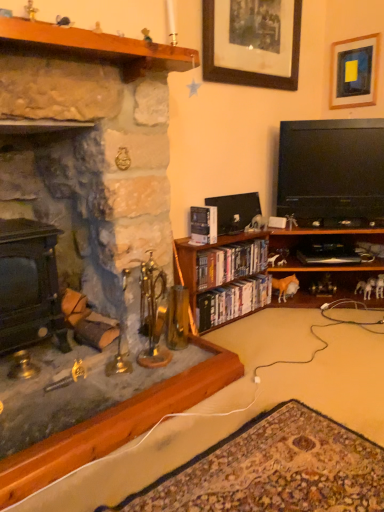
Question: Which direction should I rotate to face hardcover book at center, which is the 1th book in top-to-bottom order, — up or down?

Choices:
 (A) down
 (B) up

Answer: (B)

Question: Is matte black fireplace at left, which appears as the first fireplace when viewed from the right, at the left side of matte black stove at left, arranged as the 2th fireplace when viewed from the right?

Choices:
 (A) no
 (B) yes

Answer: (A)

Question: Can you confirm if matte black fireplace at left, which appears as the first fireplace when viewed from the right, is bigger than matte black stove at left, the first fireplace in the left-to-right sequence?

Choices:
 (A) yes
 (B) no

Answer: (A)

Question: From the image's perspective, does matte black fireplace at left, placed as the second fireplace when sorted from left to right, appear higher than matte black stove at left, arranged as the 2th fireplace when viewed from the right?

Choices:
 (A) no
 (B) yes

Answer: (B)

Question: Does matte black fireplace at left, placed as the second fireplace when sorted from left to right, come in front of matte black stove at left, the first fireplace in the left-to-right sequence?

Choices:
 (A) no
 (B) yes

Answer: (B)

Question: Is matte black fireplace at left, placed as the second fireplace when sorted from left to right, wider than matte black stove at left, arranged as the 2th fireplace when viewed from the right?

Choices:
 (A) no
 (B) yes

Answer: (B)

Question: Is matte black fireplace at left, which appears as the first fireplace when viewed from the right, not near matte black stove at left, arranged as the 2th fireplace when viewed from the right?

Choices:
 (A) no
 (B) yes

Answer: (A)

Question: Can you confirm if hardcover books at center, arranged as the third book when viewed from the top, is smaller than wooden picture frame at upper center, the second picture frame from the right?

Choices:
 (A) yes
 (B) no

Answer: (A)

Question: From the image's perspective, is hardcover books at center, arranged as the third book when viewed from the top, on wooden picture frame at upper center, placed as the first picture frame when sorted from left to right?

Choices:
 (A) no
 (B) yes

Answer: (A)

Question: From a real-world perspective, does hardcover books at center, arranged as the first book when ordered from the bottom, sit lower than wooden picture frame at upper center, the second picture frame from the right?

Choices:
 (A) no
 (B) yes

Answer: (B)

Question: Is hardcover books at center, arranged as the third book when viewed from the top, to the right of wooden picture frame at upper center, the second picture frame from the right, from the viewer's perspective?

Choices:
 (A) no
 (B) yes

Answer: (A)

Question: Is hardcover books at center, arranged as the first book when ordered from the bottom, oriented towards wooden picture frame at upper center, placed as the first picture frame when sorted from left to right?

Choices:
 (A) yes
 (B) no

Answer: (B)

Question: Does hardcover books at center, arranged as the first book when ordered from the bottom, have a greater height compared to wooden picture frame at upper center, the second picture frame from the right?

Choices:
 (A) no
 (B) yes

Answer: (A)

Question: Does wooden at left turn towards black glossy flat-screen tv at right?

Choices:
 (A) no
 (B) yes

Answer: (A)